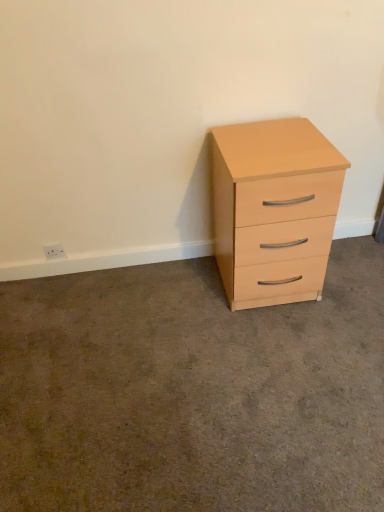
Locate an element on the screen. free space above matte wood cabinet at right (from a real-world perspective) is located at coordinates (196, 358).